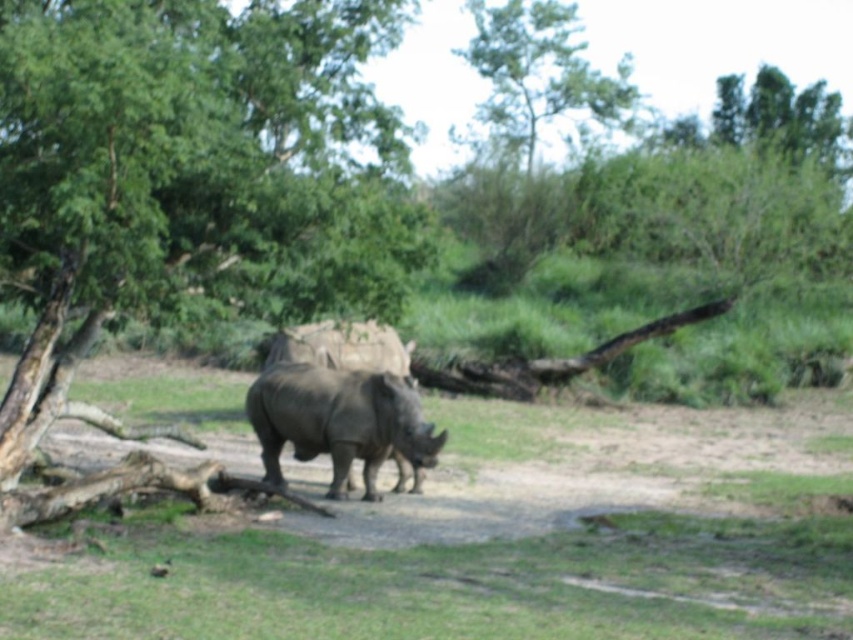
Can you confirm if green leafy tree at center is smaller than gray matte rhinoceros at center?

No, green leafy tree at center is not smaller than gray matte rhinoceros at center.

Measure the distance between green leafy tree at center and gray matte rhinoceros at center.

They are 4.20 meters apart.

Between point (285, 45) and point (430, 433), which one is positioned in front?

Point (430, 433)

This screenshot has width=853, height=640. I want to click on green leafy tree at center, so click(x=183, y=163).